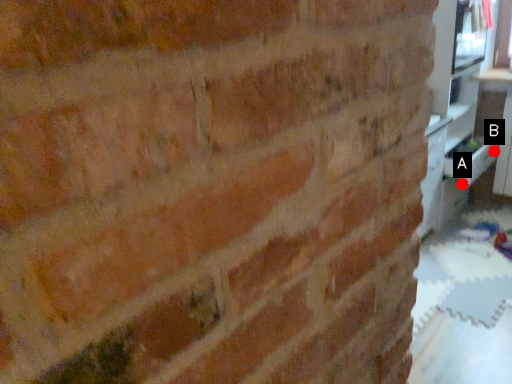
Question: Two points are circled on the image, labeled by A and B beside each circle. Which point appears farthest from the camera in this image?

Choices:
 (A) A is further
 (B) B is further

Answer: (A)